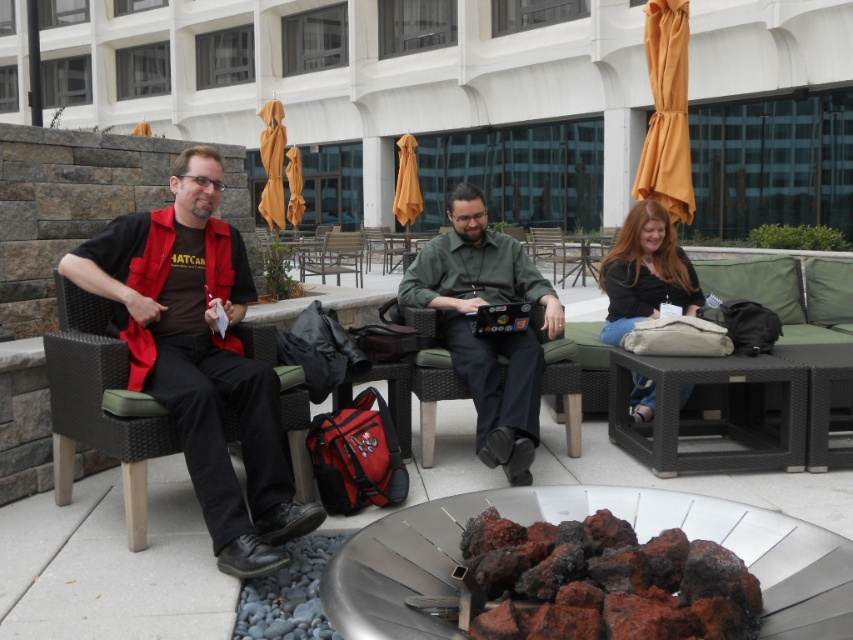
Which is more to the left, charcoal-textured rocks at center or green matte shirt at center?

green matte shirt at center

Is charcoal-textured rocks at center taller than green matte shirt at center?

In fact, charcoal-textured rocks at center may be shorter than green matte shirt at center.

Is point (598, 612) farther from camera compared to point (444, 253)?

No, it is not.

Find the location of a particular element. charcoal-textured rocks at center is located at coordinates (605, 582).

Does point (477, 244) come behind point (660, 205)?

No, (477, 244) is in front of (660, 205).

Between green matte shirt at center and matte black shirt at center, which one has less height?

Standing shorter between the two is matte black shirt at center.

Identify the location of green matte shirt at center. (486, 332).

Find the location of `green matte shirt at center`. green matte shirt at center is located at coordinates (486, 332).

Between matte black vest at left and charcoal-textured rocks at center, which one has more height?

matte black vest at left is taller.

Looking at this image, between matte black vest at left and charcoal-textured rocks at center, which one is positioned higher?

Positioned higher is matte black vest at left.

I want to click on matte black vest at left, so click(200, 358).